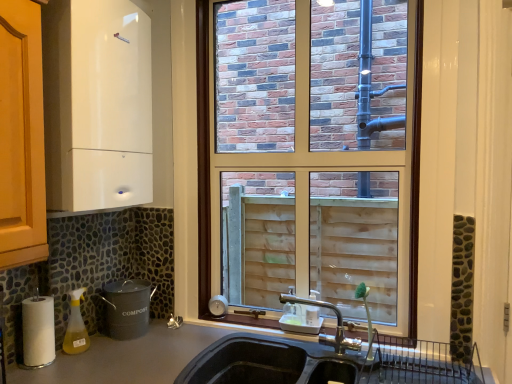
Question: Based on their sizes in the image, would you say white glossy boiler at upper left, the first appliance when ordered from top to bottom, is bigger or smaller than gray matte compost bin at lower left, the 1th appliance positioned from the bottom?

Choices:
 (A) small
 (B) big

Answer: (B)

Question: From the image's perspective, is white glossy boiler at upper left, the first appliance when ordered from top to bottom, above or below gray matte compost bin at lower left, which ranks as the 3th appliance in top-to-bottom order?

Choices:
 (A) below
 (B) above

Answer: (B)

Question: Which object is positioned farthest from the gold metallic faucet at center?

Choices:
 (A) smooth gray countertop at lower left
 (B) gray matte compost bin at lower left, which ranks as the 3th appliance in top-to-bottom order
 (C) white paper towel at lower left, arranged as the second appliance when viewed from the top
 (D) white glossy boiler at upper left, marked as the 3th appliance in a bottom-to-top arrangement
 (E) matte glass window at center

Answer: (D)

Question: Estimate the real-world distances between objects in this image. Which object is farther from the matte glass window at center?

Choices:
 (A) white paper towel at lower left, arranged as the second appliance when viewed from the top
 (B) yellow translucent spray bottle at lower left
 (C) gold metallic faucet at center
 (D) white glossy boiler at upper left, marked as the 3th appliance in a bottom-to-top arrangement
 (E) smooth gray countertop at lower left

Answer: (A)